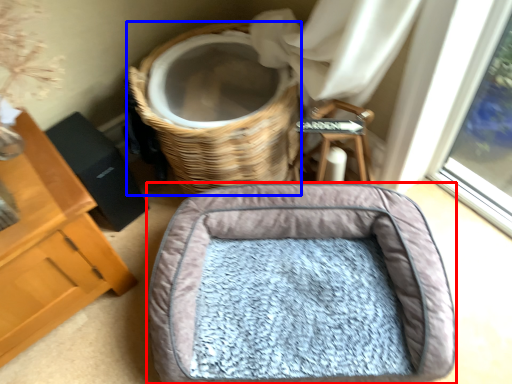
Question: Which object appears farthest to the camera in this image, dog bed (highlighted by a red box) or basket (highlighted by a blue box)?

Choices:
 (A) dog bed
 (B) basket

Answer: (B)